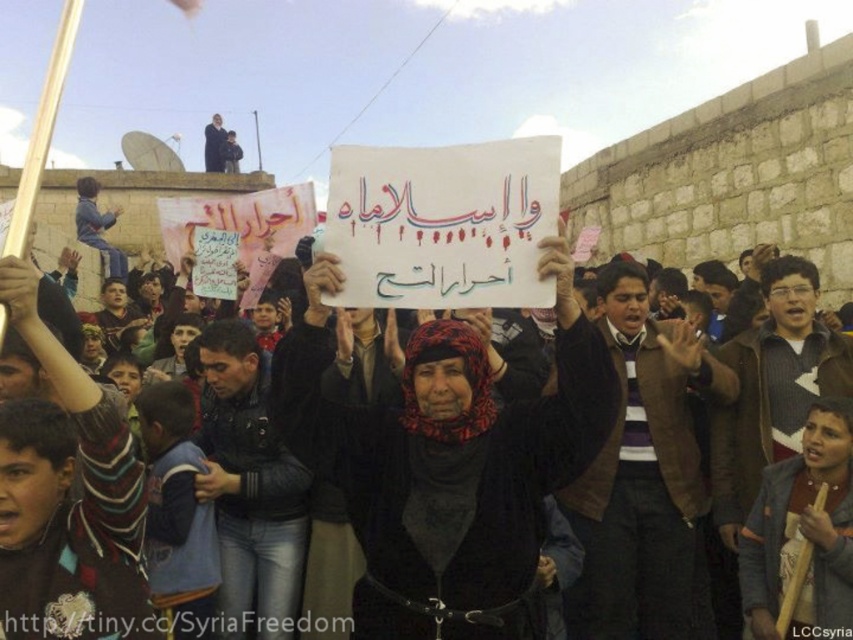
Question: Which point is farther to the camera?

Choices:
 (A) black fabric headscarf at center
 (B) white paper sign at center

Answer: (A)

Question: Where is black fabric headscarf at center located in relation to white paper sign at center in the image?

Choices:
 (A) right
 (B) left

Answer: (B)

Question: Does black fabric headscarf at center have a larger size compared to white paper sign at center?

Choices:
 (A) no
 (B) yes

Answer: (A)

Question: Is black fabric headscarf at center positioned behind white paper sign at center?

Choices:
 (A) no
 (B) yes

Answer: (B)

Question: Which point is farther to the camera?

Choices:
 (A) (582, 435)
 (B) (469, 518)

Answer: (B)